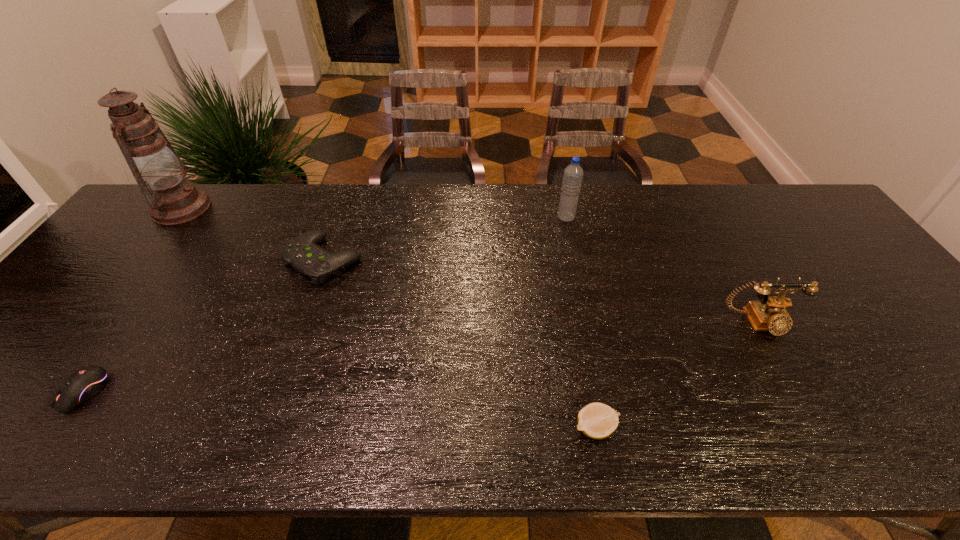
In order to click on vacant space that is in between the control and the lemon in this screenshot , I will do `click(460, 343)`.

Locate an element on the screen. free point between the lemon and the third object from left to right is located at coordinates tap(460, 343).

What are the coordinates of `blank region between the tallest object and the rightmost object` in the screenshot? It's located at (469, 266).

Locate which object ranks third in proximity to the oil lamp. Please provide its 2D coordinates. Your answer should be formatted as a tuple, i.e. [(x, y)], where the tuple contains the x and y coordinates of a point satisfying the conditions above.

[(573, 173)]

Identify the location of the fourth closest object to the computer mouse. (573, 173).

I want to click on vacant space that satisfies the following two spatial constraints: 1. on the back side of the lemon; 2. on the left side of the water bottle, so click(x=555, y=217).

Locate an element on the screen. The width and height of the screenshot is (960, 540). vacant area that satisfies the following two spatial constraints: 1. on the front side of the fourth object from right to left; 2. on the left side of the lemon is located at coordinates 264,428.

What are the coordinates of `free space that satisfies the following two spatial constraints: 1. on the front side of the water bottle; 2. on the right side of the tallest object` in the screenshot? It's located at 175,217.